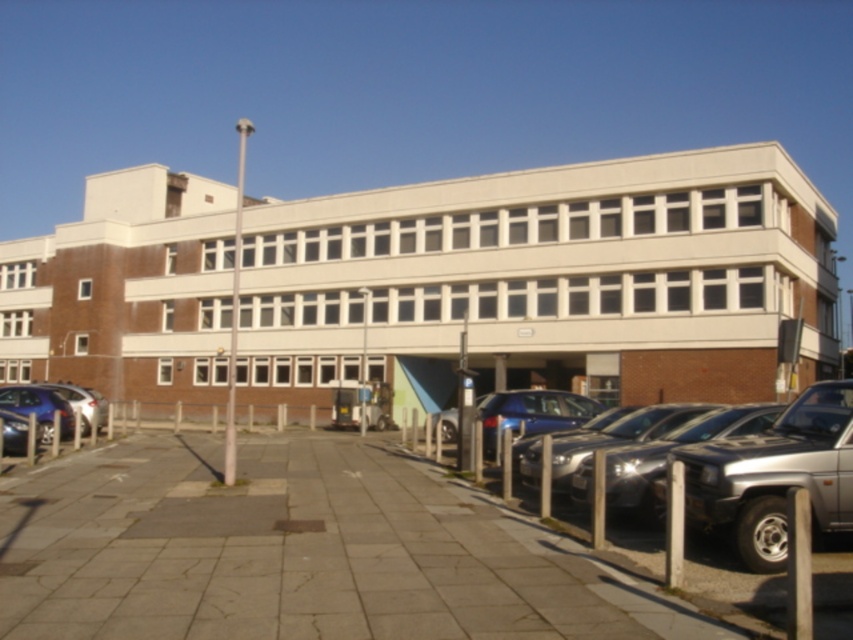
You are a delivery person who needs to park your van, which is 6 meters long, in the parking lot. You see the silver metallic car at center right and the shiny blue sedan at left. Can you determine if there is enough space between them to park your van?

The silver metallic car at center right is shorter than the shiny blue sedan at left, but the exact distance between them isn not provided. Without knowing the space between the two vehicles, it is impossible to determine if there is enough room for a 6 meter van.